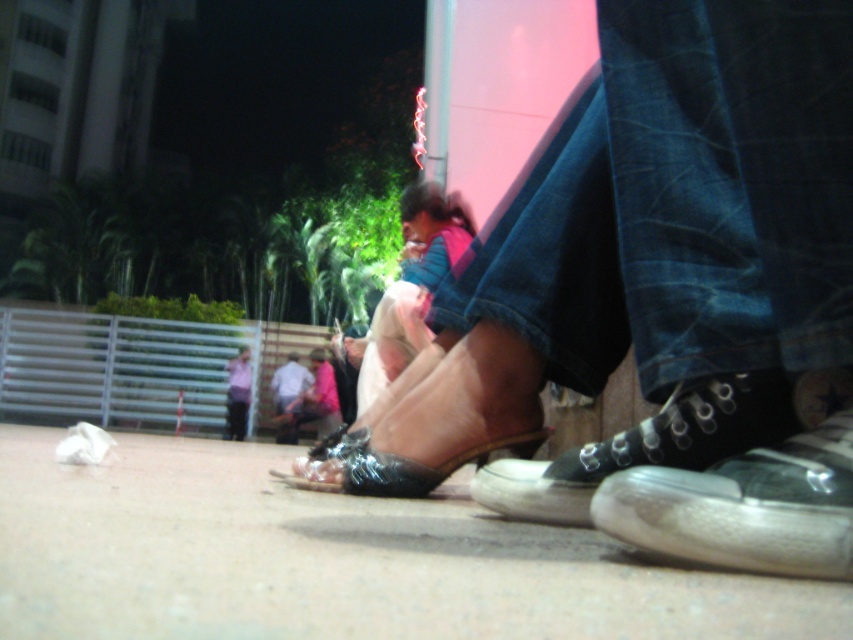
Who is lower down, smooth concrete pavement at lower center or pink fabric shirt at lower center?

pink fabric shirt at lower center is lower down.

Consider the image. Between smooth concrete pavement at lower center and pink fabric shirt at lower center, which one appears on the left side from the viewer's perspective?

pink fabric shirt at lower center

Is point (479, 588) positioned after point (245, 365)?

That is False.

Where is `smooth concrete pavement at lower center`? smooth concrete pavement at lower center is located at coordinates (334, 560).

Between point (837, 563) and point (753, 436), which one is positioned in front?

Point (837, 563) is more forward.

Can you confirm if white canvas sneaker at lower right is taller than black canvas shoe at lower right?

No.

I want to click on white canvas sneaker at lower right, so click(744, 506).

Who is taller, smooth concrete pavement at lower center or light blue shirt at lower center?

Standing taller between the two is light blue shirt at lower center.

Is smooth concrete pavement at lower center below light blue shirt at lower center?

No, smooth concrete pavement at lower center is not below light blue shirt at lower center.

What are the coordinates of `smooth concrete pavement at lower center` in the screenshot? It's located at (334, 560).